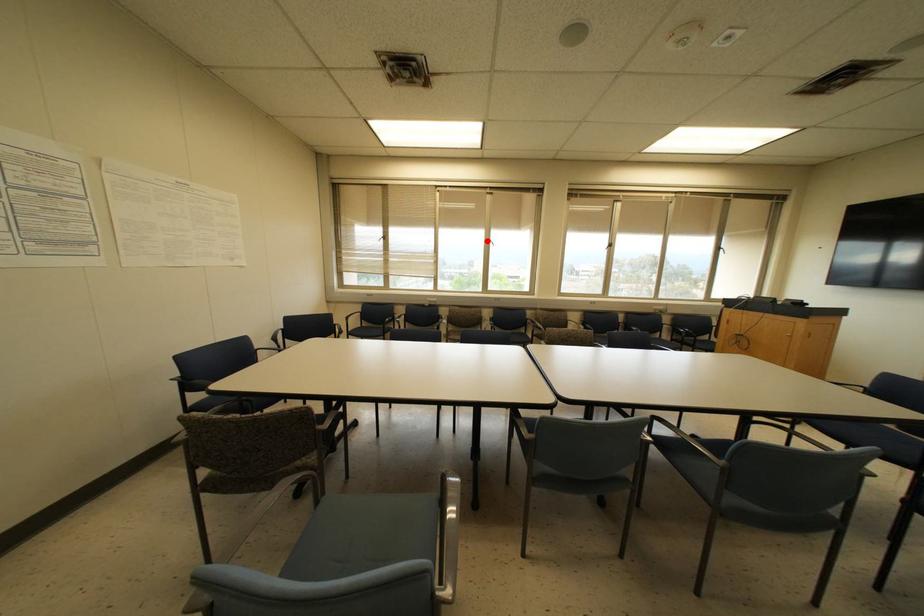
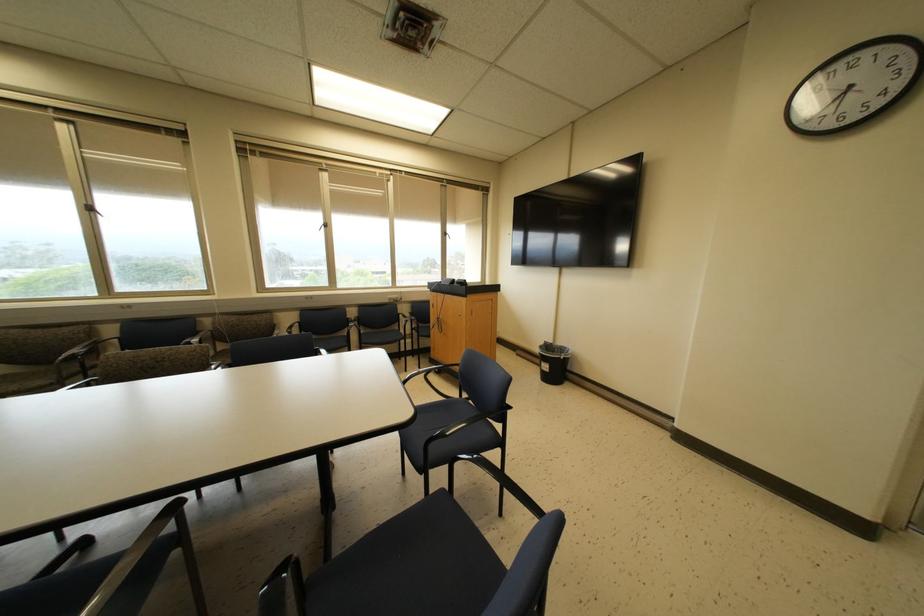
Where in the second image is the point corresponding to the highlighted location from the first image?

(89, 208)